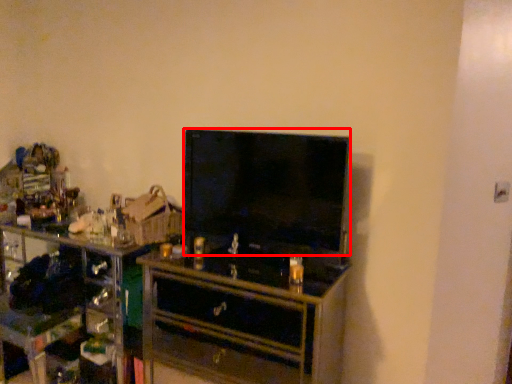
Question: From the image's perspective, where is television (annotated by the red box) located relative to chest of drawers?

Choices:
 (A) above
 (B) below

Answer: (A)